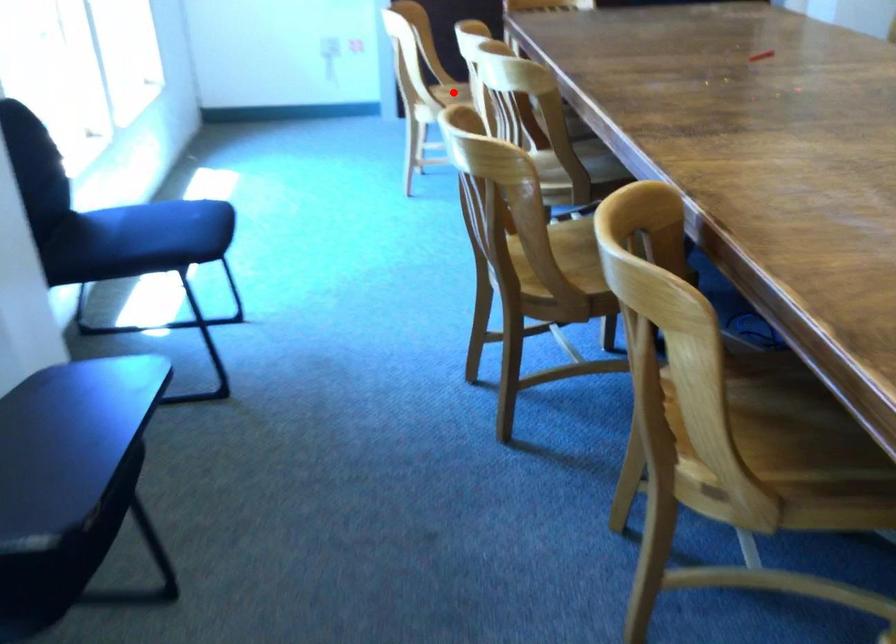
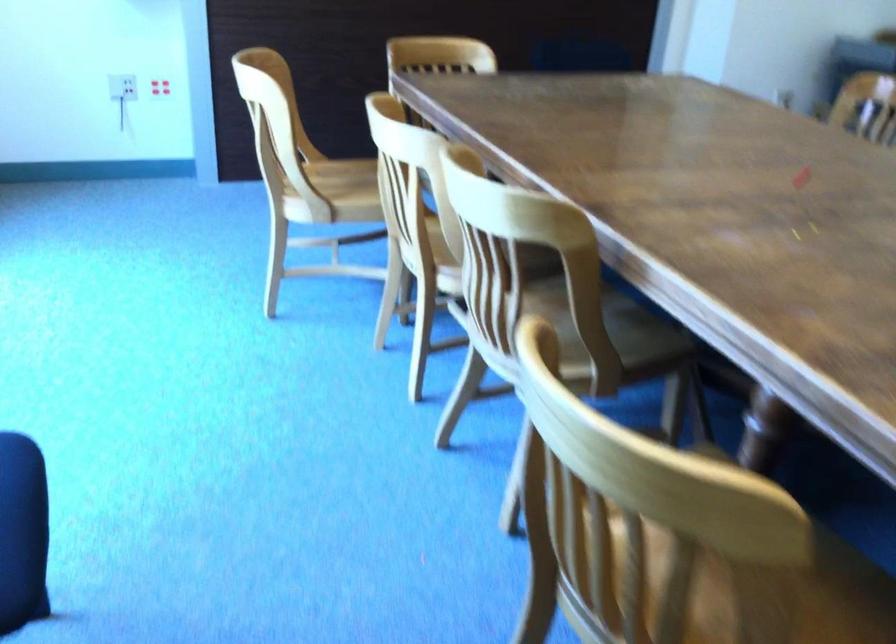
Question: I am providing you with two images of the same scene from different viewpoints. A red point is shown in image1. For the corresponding object point in image2, is it positioned nearer or farther from the camera?

Choices:
 (A) Nearer
 (B) Farther

Answer: (A)